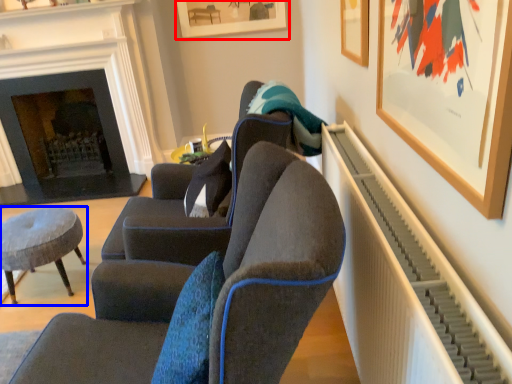
Question: Which point is further to the camera, picture frame (highlighted by a red box) or stool (highlighted by a blue box)?

Choices:
 (A) picture frame
 (B) stool

Answer: (A)